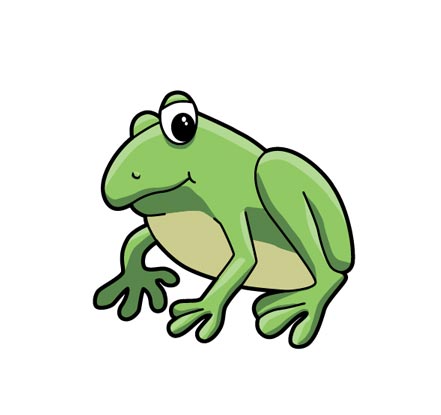
Find the location of a particular element. Image resolution: width=441 pixels, height=415 pixels. poster is located at coordinates (297, 285).